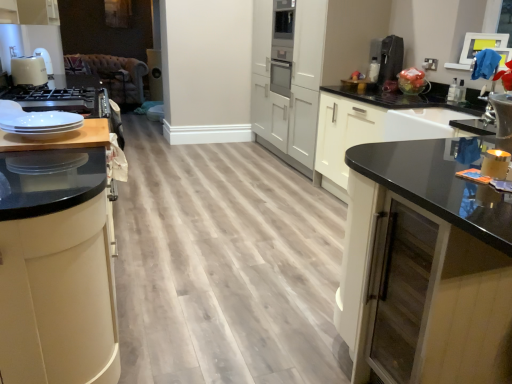
Question: Is matte black cabinet at left, positioned as the 1th cabinetry in left-to-right order, not within black glass cabinet at right, the second cabinetry when ordered from left to right?

Choices:
 (A) no
 (B) yes

Answer: (B)

Question: Is matte black cabinet at left, positioned as the 1th cabinetry in left-to-right order, positioned with its back to black glass cabinet at right, placed as the first cabinetry when sorted from right to left?

Choices:
 (A) no
 (B) yes

Answer: (A)

Question: Is matte black cabinet at left, positioned as the 1th cabinetry in left-to-right order, smaller than black glass cabinet at right, placed as the first cabinetry when sorted from right to left?

Choices:
 (A) no
 (B) yes

Answer: (B)

Question: Can you confirm if matte black cabinet at left, positioned as the 1th cabinetry in left-to-right order, is thinner than black glass cabinet at right, the second cabinetry when ordered from left to right?

Choices:
 (A) no
 (B) yes

Answer: (B)

Question: From a real-world perspective, is matte black cabinet at left, positioned as the 1th cabinetry in left-to-right order, located higher than black glass cabinet at right, the second cabinetry when ordered from left to right?

Choices:
 (A) no
 (B) yes

Answer: (B)

Question: Is point (390, 72) positioned closer to the camera than point (103, 145)?

Choices:
 (A) closer
 (B) farther

Answer: (B)

Question: From the image's perspective, is satin black coffee machine at upper right located above or below wooden cutting board at left?

Choices:
 (A) above
 (B) below

Answer: (A)

Question: Is satin black coffee machine at upper right in front of or behind wooden cutting board at left in the image?

Choices:
 (A) behind
 (B) front

Answer: (A)

Question: Would you say satin black coffee machine at upper right is inside or outside wooden cutting board at left?

Choices:
 (A) inside
 (B) outside

Answer: (B)

Question: Choose the correct answer: Is matte black cabinet at left, positioned as the 1th cabinetry in left-to-right order, inside satin black coffee machine at upper right or outside it?

Choices:
 (A) inside
 (B) outside

Answer: (B)

Question: From the image's perspective, is matte black cabinet at left, which is the second cabinetry from right to left, above or below satin black coffee machine at upper right?

Choices:
 (A) below
 (B) above

Answer: (A)

Question: Is matte black cabinet at left, positioned as the 1th cabinetry in left-to-right order, wider or thinner than satin black coffee machine at upper right?

Choices:
 (A) wide
 (B) thin

Answer: (A)

Question: From a real-world perspective, relative to satin black coffee machine at upper right, is matte black cabinet at left, which is the second cabinetry from right to left, vertically above or below?

Choices:
 (A) above
 (B) below

Answer: (B)

Question: Is brown leather couch at upper left to the left or to the right of satin black coffee machine at upper right in the image?

Choices:
 (A) right
 (B) left

Answer: (B)

Question: Based on their sizes in the image, would you say brown leather couch at upper left is bigger or smaller than satin black coffee machine at upper right?

Choices:
 (A) small
 (B) big

Answer: (B)